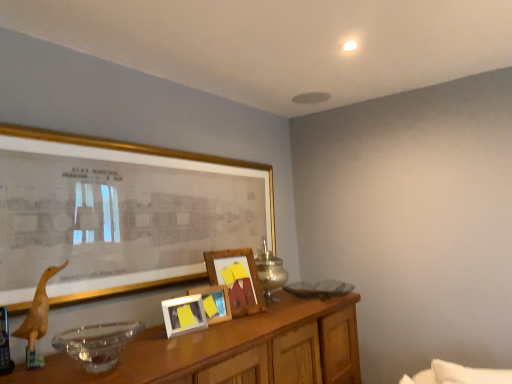
You are a GUI agent. You are given a task and a screenshot of the screen. Output one action in this format:
    pyautogui.click(x=<x>, y=<y>)
    Task: Click on the vacant area that is situated to the right of matte wooden picture frame at center, which is the second picture frame in front-to-back order
    The image size is (512, 384).
    Given the screenshot: What is the action you would take?
    pyautogui.click(x=216, y=324)